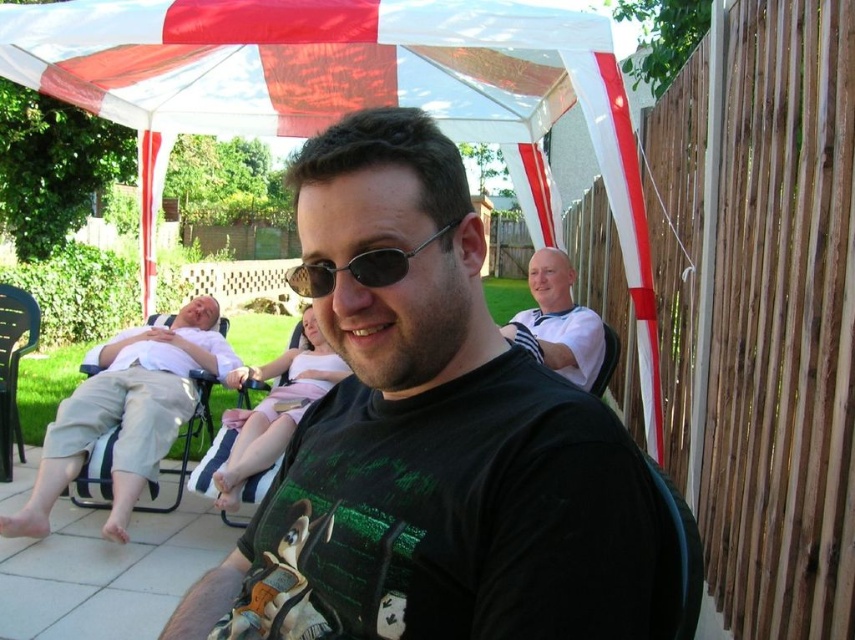
Can you confirm if white fabric canopy at upper center is taller than white cotton shirt at upper right?

Yes.

What do you see at coordinates (352, 92) in the screenshot? The height and width of the screenshot is (640, 855). I see `white fabric canopy at upper center` at bounding box center [352, 92].

Where is `white fabric canopy at upper center`? This screenshot has width=855, height=640. white fabric canopy at upper center is located at coordinates (352, 92).

Can you confirm if black matte t-shirt at center is shorter than sunglasses at center?

Yes.

Is black matte t-shirt at center closer to the viewer compared to sunglasses at center?

Yes.

Does point (209, 620) lie in front of point (385, 268)?

That is False.

In order to click on black matte t-shirt at center in this screenshot , I will do `click(433, 440)`.

Does white fabric canopy at upper center have a lesser width compared to black plastic chair at right?

No.

Which is more to the left, white fabric canopy at upper center or black plastic chair at right?

white fabric canopy at upper center

Who is more distant from viewer, [217,131] or [606,376]?

Positioned behind is point [217,131].

Locate an element on the screen. The image size is (855, 640). white fabric canopy at upper center is located at coordinates (352, 92).